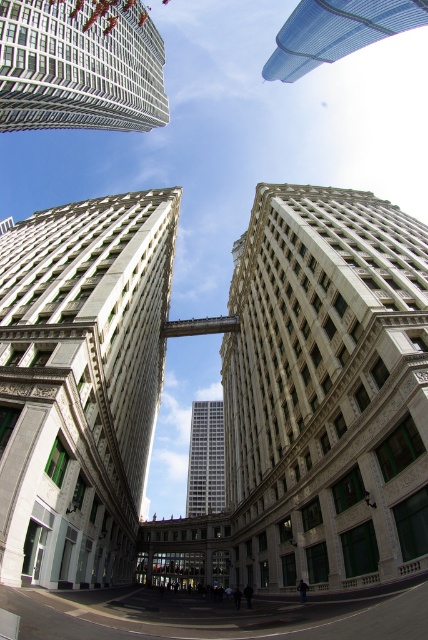
Who is shorter, white stone building at center or transparent glass skyscraper at upper center?

Standing shorter between the two is transparent glass skyscraper at upper center.

Looking at this image, can you confirm if white stone building at center is positioned to the right of transparent glass skyscraper at upper center?

No, white stone building at center is not to the right of transparent glass skyscraper at upper center.

I want to click on white stone building at center, so click(326, 390).

Does white glass skyscraper at upper left appear under transparent glass skyscraper at upper center?

Yes, white glass skyscraper at upper left is below transparent glass skyscraper at upper center.

Measure the distance between white glass skyscraper at upper left and transparent glass skyscraper at upper center.

Result: They are 101.63 meters apart.

Between point (79, 26) and point (419, 1), which one is positioned in front?

Point (79, 26) is more forward.

I want to click on white glass skyscraper at upper left, so click(80, 65).

Which is below, white stone building at center or white marble building at center?

white marble building at center is below.

Between white stone building at center and white marble building at center, which one appears on the right side from the viewer's perspective?

From the viewer's perspective, white stone building at center appears more on the right side.

Does point (264, 483) come closer to viewer compared to point (80, 339)?

That is False.

This screenshot has width=428, height=640. What are the coordinates of `white stone building at center` in the screenshot? It's located at (326, 390).